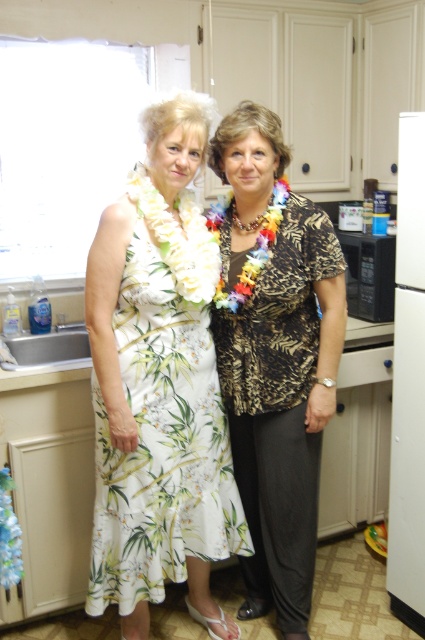
You are a photographer standing in the kitchen and want to take a closeup photo of the printed fabric blouse at center. Based on the description, can you estimate if you need to move closer or farther away from your current position to focus on the blouse?

The printed fabric blouse at center is 1.77 meters away from camera. To take a closeup photo, you need to move closer than 1.77 meters to focus on the blouse.

You are a photographer setting up a shoot in the kitchen. You want to ensure both the printed fabric blouse at center and the white floral dress at center are visible in the frame. Given their current positions, which one might you need to adjust to avoid blocking the other?

The white floral dress at center is behind the printed fabric blouse at center, so you would need to adjust the printed fabric blouse at center to move it forward or reposition the white floral dress at center to ensure both are visible.

You are organizing a clothing display in a store and need to arrange the printed fabric blouse at center and the white floral dress at center based on their positions in the image. Which clothing item is located to the right of the other?

The printed fabric blouse at center is positioned on the right side of the white floral dress at center, so it is to the right of the dress.